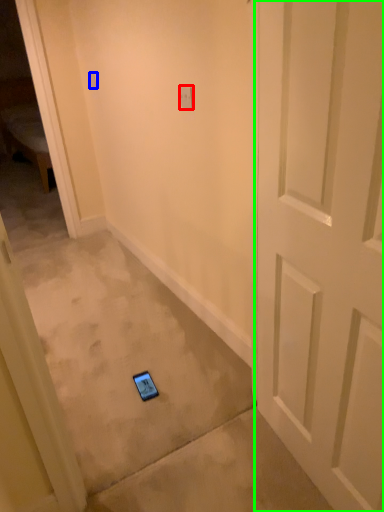
Question: Which is nearer to the light switch (highlighted by a red box)? light switch (highlighted by a blue box) or door (highlighted by a green box).

Choices:
 (A) light switch
 (B) door

Answer: (B)